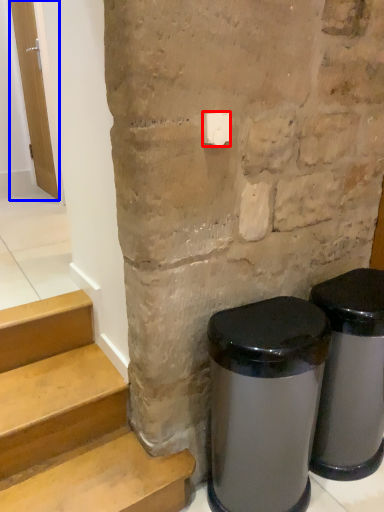
Question: Which object is further to the camera taking this photo, light switch (highlighted by a red box) or door (highlighted by a blue box)?

Choices:
 (A) light switch
 (B) door

Answer: (B)